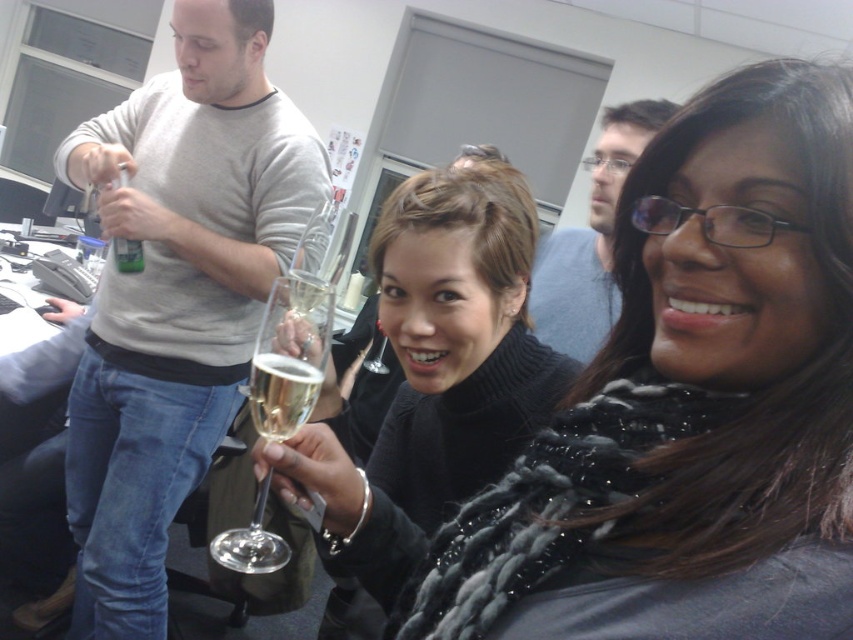
Does gray matte sweater at upper left have a greater width compared to gold metallic champagne glass at center?

Yes, gray matte sweater at upper left is wider than gold metallic champagne glass at center.

Measure the distance from gray matte sweater at upper left to gold metallic champagne glass at center.

A distance of 34.26 inches exists between gray matte sweater at upper left and gold metallic champagne glass at center.

Is point (202, 390) in front of point (270, 378)?

No, it is behind (270, 378).

Locate an element on the screen. The width and height of the screenshot is (853, 640). gray matte sweater at upper left is located at coordinates (177, 294).

Which is below, light blue sweater at center or gold metallic champagne glass at center?

Positioned lower is gold metallic champagne glass at center.

Is light blue sweater at center to the right of gold metallic champagne glass at center from the viewer's perspective?

Indeed, light blue sweater at center is positioned on the right side of gold metallic champagne glass at center.

Does point (611, 168) lie behind point (274, 374)?

Yes, it is behind point (274, 374).

The height and width of the screenshot is (640, 853). What are the coordinates of `light blue sweater at center` in the screenshot? It's located at (590, 240).

Between point (759, 74) and point (350, 515), which one is positioned behind?

Point (350, 515)

Does point (833, 525) lie in front of point (496, 371)?

Yes, point (833, 525) is in front of point (496, 371).

Locate an element on the screen. This screenshot has height=640, width=853. black textured scarf at center is located at coordinates (689, 404).